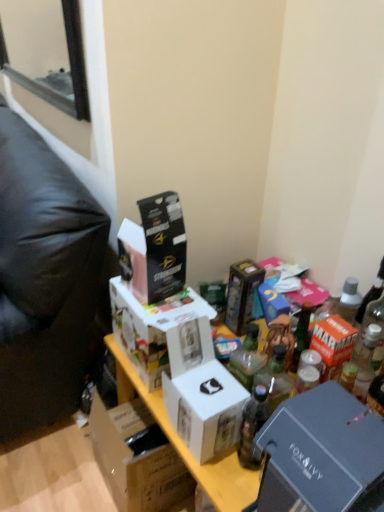
You are a GUI agent. You are given a task and a screenshot of the screen. Output one action in this format:
    pyautogui.click(x=<x>, y=<y>)
    Task: Click on the black cardboard box at upper center, the sixth box when ordered from bottom to top
    The width and height of the screenshot is (384, 512).
    Given the screenshot: What is the action you would take?
    pyautogui.click(x=154, y=249)

What do you see at coordinates (154, 249) in the screenshot? I see `black cardboard box at upper center, the sixth box when ordered from bottom to top` at bounding box center [154, 249].

Image resolution: width=384 pixels, height=512 pixels. Find the location of `white cardboard box at center, the first box ordered from the bottom`. white cardboard box at center, the first box ordered from the bottom is located at coordinates (136, 456).

In order to click on white cardboard box at center, the 4th box viewed from the top in this screenshot , I will do `click(205, 408)`.

What do you see at coordinates (242, 293) in the screenshot? Image resolution: width=384 pixels, height=512 pixels. I see `metallic gold box at center, acting as the 5th box starting from the bottom` at bounding box center [242, 293].

I want to click on clear glass bottle at upper right, the 1th bottle from the top, so click(371, 294).

This screenshot has width=384, height=512. I want to click on translucent glass bottle at center, acting as the 1th bottle starting from the left, so click(252, 426).

What are the coordinates of `black cardboard box at upper center, the 1th box from the top` in the screenshot? It's located at (154, 249).

Considering the relative positions of metallic gold box at center, acting as the 5th box starting from the bottom, and clear glass bottle at upper right, the 2th bottle when ordered from bottom to top, in the image provided, is metallic gold box at center, acting as the 5th box starting from the bottom, to the left or to the right of clear glass bottle at upper right, the 2th bottle when ordered from bottom to top,?

metallic gold box at center, acting as the 5th box starting from the bottom, is positioned on clear glass bottle at upper right, the 2th bottle when ordered from bottom to top,'s left side.

Is metallic gold box at center, acting as the 5th box starting from the bottom, wider than clear glass bottle at upper right, the 2th bottle when ordered from bottom to top?

Correct, the width of metallic gold box at center, acting as the 5th box starting from the bottom, exceeds that of clear glass bottle at upper right, the 2th bottle when ordered from bottom to top.

Is metallic gold box at center, acting as the 5th box starting from the bottom, not close to clear glass bottle at upper right, placed as the 1th bottle when sorted from back to front?

They are positioned close to each other.

From the image's perspective, is white cardboard box at center, the 4th box viewed from the top, on top of black leather bean bag at left?

No.

Is white cardboard box at center, which is the third box from bottom to top, smaller than black leather bean bag at left?

Yes.

Who is shorter, white cardboard box at center, which is the third box from bottom to top, or black leather bean bag at left?

With less height is white cardboard box at center, which is the third box from bottom to top.

How far apart are white cardboard box at center, the 4th box viewed from the top, and black leather bean bag at left?

white cardboard box at center, the 4th box viewed from the top, and black leather bean bag at left are 22.74 inches apart.

Looking at their sizes, would you say black leather bean bag at left is wider or thinner than metallic gold box at center, positioned as the second box in top-to-bottom order?

black leather bean bag at left is wider than metallic gold box at center, positioned as the second box in top-to-bottom order.

From a real-world perspective, which object rests below the other?

black leather bean bag at left.

Does black leather bean bag at left turn towards metallic gold box at center, acting as the 5th box starting from the bottom?

No, black leather bean bag at left is not oriented towards metallic gold box at center, acting as the 5th box starting from the bottom.

Does black leather bean bag at left have a larger size compared to metallic gold box at center, positioned as the second box in top-to-bottom order?

Yes.

Does white cardboard box at center, the 3th box viewed from the top, appear on the left side of metallic gold box at center, acting as the 5th box starting from the bottom?

Correct, you'll find white cardboard box at center, the 3th box viewed from the top, to the left of metallic gold box at center, acting as the 5th box starting from the bottom.

How distant is white cardboard box at center, the fourth box ordered from the bottom, from metallic gold box at center, acting as the 5th box starting from the bottom?

white cardboard box at center, the fourth box ordered from the bottom, is 10.89 inches from metallic gold box at center, acting as the 5th box starting from the bottom.

Is white cardboard box at center, the 3th box viewed from the top, placed right next to metallic gold box at center, acting as the 5th box starting from the bottom?

No, white cardboard box at center, the 3th box viewed from the top, is not next to metallic gold box at center, acting as the 5th box starting from the bottom.

How many degrees apart are the facing directions of white cardboard box at center, the 3th box viewed from the top, and metallic gold box at center, acting as the 5th box starting from the bottom?

The angular difference between white cardboard box at center, the 3th box viewed from the top, and metallic gold box at center, acting as the 5th box starting from the bottom, is 0.000124 degrees.

Considering the relative sizes of metallic gold box at center, positioned as the second box in top-to-bottom order, and metallic gray box at lower right, the 5th box when ordered from top to bottom, in the image provided, is metallic gold box at center, positioned as the second box in top-to-bottom order, shorter than metallic gray box at lower right, the 5th box when ordered from top to bottom,?

Correct, metallic gold box at center, positioned as the second box in top-to-bottom order, is not as tall as metallic gray box at lower right, the 5th box when ordered from top to bottom.

From a real-world perspective, is metallic gold box at center, acting as the 5th box starting from the bottom, positioned over metallic gray box at lower right, the second box ordered from the bottom, based on gravity?

No.

In the scene shown: Is metallic gold box at center, positioned as the second box in top-to-bottom order, not near metallic gray box at lower right, the 5th box when ordered from top to bottom?

No, metallic gold box at center, positioned as the second box in top-to-bottom order, is not far from metallic gray box at lower right, the 5th box when ordered from top to bottom.

In the scene shown: Considering the relative sizes of translucent glass bottle at center, which is the 1th bottle in front-to-back order, and metallic gray box at lower right, the 5th box when ordered from top to bottom, in the image provided, is translucent glass bottle at center, which is the 1th bottle in front-to-back order, wider than metallic gray box at lower right, the 5th box when ordered from top to bottom,?

No.

Which object is further away from the camera taking this photo, translucent glass bottle at center, which is the 1th bottle in front-to-back order, or metallic gray box at lower right, the 5th box when ordered from top to bottom?

translucent glass bottle at center, which is the 1th bottle in front-to-back order, is further from the camera.

Based on the photo, is translucent glass bottle at center, the first bottle ordered from the bottom, bigger or smaller than metallic gray box at lower right, the second box ordered from the bottom?

Clearly, translucent glass bottle at center, the first bottle ordered from the bottom, is smaller in size than metallic gray box at lower right, the second box ordered from the bottom.

From a real-world perspective, is metallic gray box at lower right, the second box ordered from the bottom, positioned under translucent glass bottle at center, acting as the 1th bottle starting from the left, based on gravity?

No, from a real-world perspective, metallic gray box at lower right, the second box ordered from the bottom, is not below translucent glass bottle at center, acting as the 1th bottle starting from the left.

Is metallic gray box at lower right, the second box ordered from the bottom, oriented towards translucent glass bottle at center, which is the 1th bottle in front-to-back order?

No, metallic gray box at lower right, the second box ordered from the bottom, does not turn towards translucent glass bottle at center, which is the 1th bottle in front-to-back order.

Considering the sizes of objects metallic gray box at lower right, the second box ordered from the bottom, and translucent glass bottle at center, the first bottle ordered from the bottom, in the image provided, who is thinner, metallic gray box at lower right, the second box ordered from the bottom, or translucent glass bottle at center, the first bottle ordered from the bottom,?

With smaller width is translucent glass bottle at center, the first bottle ordered from the bottom.

Identify the location of the 2nd box to the right of the translucent glass bottle at center, which is the second bottle in top-to-bottom order, starting your count from the anchor. (321, 454).

At what (x,y) coordinates should I click in order to perform the action: click on bottle located on the right of metallic gold box at center, positioned as the second box in top-to-bottom order. Please return your answer as a coordinate pair (x, y). This screenshot has width=384, height=512. Looking at the image, I should click on (371, 294).

The width and height of the screenshot is (384, 512). There is a black leather bean bag at left. What are the coordinates of `the 3rd box above it (from a real-world perspective)` in the screenshot? It's located at (205, 408).

When comparing their distances from white cardboard box at center, which is the third box from bottom to top, does clear glass bottle at upper right, which is counted as the second bottle, starting from the left, or metallic gold box at center, positioned as the second box in top-to-bottom order, seem closer?

Among the two, metallic gold box at center, positioned as the second box in top-to-bottom order, is located nearer to white cardboard box at center, which is the third box from bottom to top.

Based on their spatial positions, is metallic gold box at center, acting as the 5th box starting from the bottom, or translucent glass bottle at center, arranged as the 2th bottle when viewed from the back, further from white cardboard box at center, the first box ordered from the bottom?

metallic gold box at center, acting as the 5th box starting from the bottom, is positioned further to the anchor white cardboard box at center, the first box ordered from the bottom.

Based on their spatial positions, is black leather bean bag at left or metallic gold box at center, positioned as the second box in top-to-bottom order, closer to translucent glass bottle at center, acting as the 2th bottle starting from the right?

metallic gold box at center, positioned as the second box in top-to-bottom order, lies closer to translucent glass bottle at center, acting as the 2th bottle starting from the right, than the other object.

When comparing their distances from black leather bean bag at left, does metallic gray box at lower right, the 5th box when ordered from top to bottom, or metallic gold box at center, positioned as the second box in top-to-bottom order, seem further?

Based on the image, metallic gray box at lower right, the 5th box when ordered from top to bottom, appears to be further to black leather bean bag at left.

Consider the image. When comparing their distances from white cardboard box at center, which appears as the sixth box when viewed from the top, does clear glass bottle at upper right, the 1th bottle from the top, or translucent glass bottle at center, arranged as the 2th bottle when viewed from the back, seem closer?

Among the two, translucent glass bottle at center, arranged as the 2th bottle when viewed from the back, is located nearer to white cardboard box at center, which appears as the sixth box when viewed from the top.

When comparing their distances from metallic gold box at center, acting as the 5th box starting from the bottom, does black leather bean bag at left or metallic gray box at lower right, the 5th box when ordered from top to bottom, seem closer?

Based on the image, black leather bean bag at left appears to be nearer to metallic gold box at center, acting as the 5th box starting from the bottom.

Based on the photo, based on their spatial positions, is metallic gray box at lower right, the 5th box when ordered from top to bottom, or clear glass bottle at upper right, which is counted as the second bottle, starting from the left, closer to metallic gold box at center, acting as the 5th box starting from the bottom?

The object closer to metallic gold box at center, acting as the 5th box starting from the bottom, is clear glass bottle at upper right, which is counted as the second bottle, starting from the left.

Estimate the real-world distances between objects in this image. Which object is closer to metallic gray box at lower right, the second box ordered from the bottom, white cardboard box at center, the first box ordered from the bottom, or white cardboard box at center, the 4th box viewed from the top?

white cardboard box at center, the 4th box viewed from the top, is closer to metallic gray box at lower right, the second box ordered from the bottom.

Image resolution: width=384 pixels, height=512 pixels. What are the coordinates of `bottle between white cardboard box at center, the 3th box viewed from the top, and clear glass bottle at upper right, which appears as the 2th bottle when viewed from the front, from left to right` in the screenshot? It's located at click(x=252, y=426).

At what (x,y) coordinates should I click in order to perform the action: click on bottle between metallic gray box at lower right, the 5th box when ordered from top to bottom, and white cardboard box at center, the 3th box viewed from the top, from front to back. Please return your answer as a coordinate pair (x, y). Looking at the image, I should click on (252, 426).

At what (x,y) coordinates should I click in order to perform the action: click on bottle located between white cardboard box at center, the first box ordered from the bottom, and clear glass bottle at upper right, the first bottle positioned from the right, in the left-right direction. Please return your answer as a coordinate pair (x, y). The image size is (384, 512). Looking at the image, I should click on (252, 426).

I want to click on box between black leather bean bag at left and black cardboard box at upper center, the 1th box from the top, from left to right, so pyautogui.click(x=136, y=456).